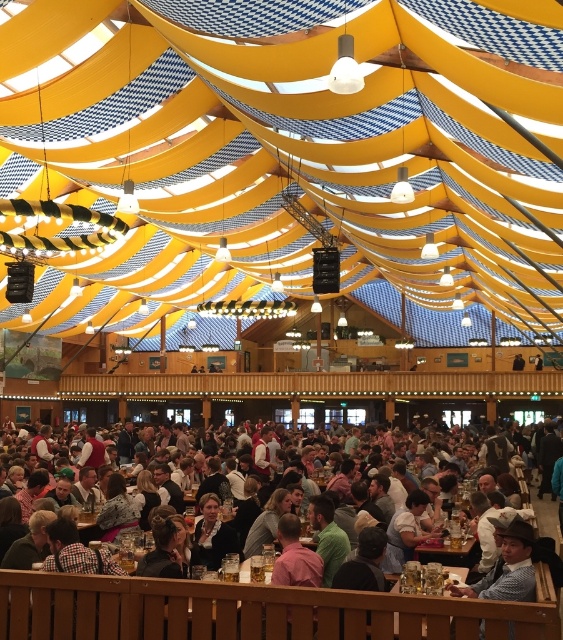
Question: Does white shirt at center lie behind wooden table at lower center?

Choices:
 (A) yes
 (B) no

Answer: (B)

Question: Is white shirt at center to the left of wooden table at lower center from the viewer's perspective?

Choices:
 (A) no
 (B) yes

Answer: (B)

Question: Is white shirt at center thinner than wooden table at lower center?

Choices:
 (A) no
 (B) yes

Answer: (B)

Question: Which of the following is the closest to the observer?

Choices:
 (A) (394, 584)
 (B) (256, 620)

Answer: (B)

Question: Which point is farther to the camera?

Choices:
 (A) (207, 632)
 (B) (422, 625)

Answer: (A)